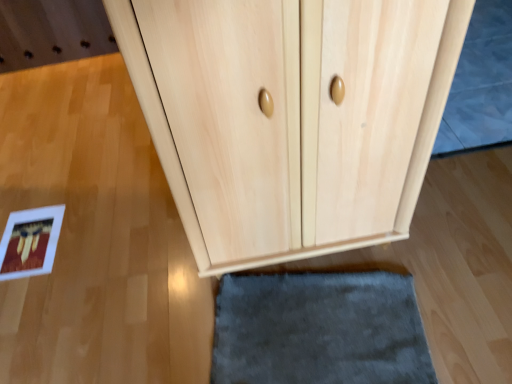
Identify the location of blank space above gray soft rug at upper right (from a real-world perspective). (483, 63).